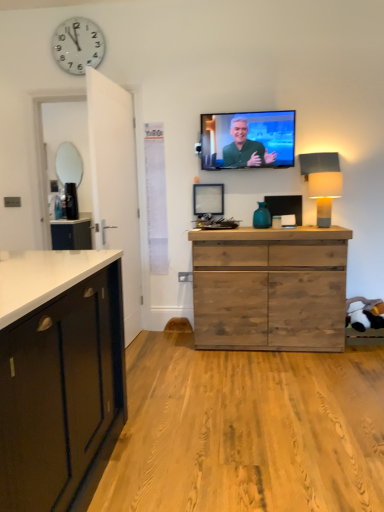
What are the coordinates of `empty space that is ontop of matte green screen at upper center (from a real-world perspective)` in the screenshot? It's located at (249, 113).